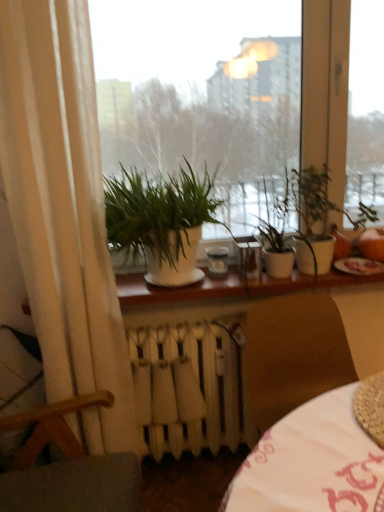
Question: Can you confirm if white glossy window sill at center is positioned to the right of white metallic radiator at lower center?

Choices:
 (A) no
 (B) yes

Answer: (B)

Question: Is white glossy window sill at center bigger than white metallic radiator at lower center?

Choices:
 (A) yes
 (B) no

Answer: (B)

Question: Can you confirm if white glossy window sill at center is taller than white metallic radiator at lower center?

Choices:
 (A) yes
 (B) no

Answer: (B)

Question: From a real-world perspective, is white glossy window sill at center on white metallic radiator at lower center?

Choices:
 (A) yes
 (B) no

Answer: (A)

Question: Does white glossy window sill at center have a smaller size compared to white metallic radiator at lower center?

Choices:
 (A) yes
 (B) no

Answer: (A)

Question: Are white glossy window sill at center and white metallic radiator at lower center located far from each other?

Choices:
 (A) no
 (B) yes

Answer: (A)

Question: From a real-world perspective, is white fabric curtain at left under white metallic radiator at lower center?

Choices:
 (A) no
 (B) yes

Answer: (A)

Question: Considering the relative sizes of white fabric curtain at left and white metallic radiator at lower center in the image provided, is white fabric curtain at left bigger than white metallic radiator at lower center?

Choices:
 (A) yes
 (B) no

Answer: (A)

Question: From a real-world perspective, is white fabric curtain at left located higher than white metallic radiator at lower center?

Choices:
 (A) no
 (B) yes

Answer: (B)

Question: Is white fabric curtain at left wider than white metallic radiator at lower center?

Choices:
 (A) yes
 (B) no

Answer: (A)

Question: Considering the relative sizes of white fabric curtain at left and white metallic radiator at lower center in the image provided, is white fabric curtain at left smaller than white metallic radiator at lower center?

Choices:
 (A) yes
 (B) no

Answer: (B)

Question: Is white metallic radiator at lower center located within white fabric curtain at left?

Choices:
 (A) no
 (B) yes

Answer: (A)

Question: Does white glossy window at center have a larger size compared to wooden armchair at lower left?

Choices:
 (A) yes
 (B) no

Answer: (B)